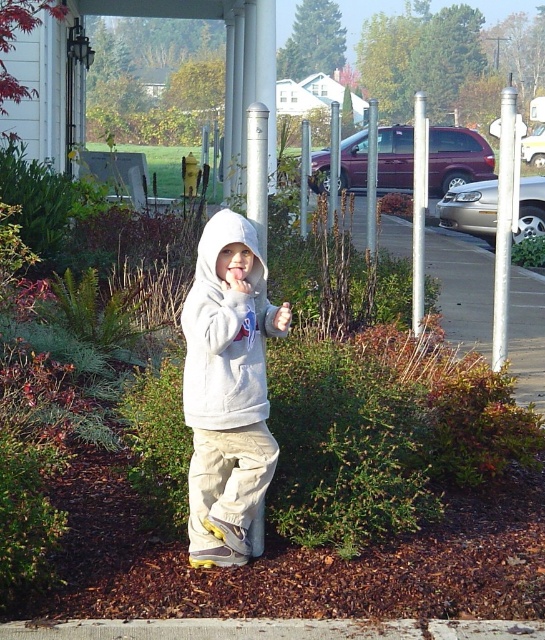
Is light gray hoodie at center smaller than silver metallic pole at center?

Yes, light gray hoodie at center is smaller than silver metallic pole at center.

Is light gray hoodie at center shorter than silver metallic pole at center?

Yes, light gray hoodie at center is shorter than silver metallic pole at center.

At what (x,y) coordinates should I click in order to perform the action: click on light gray hoodie at center. Please return your answer as a coordinate pair (x, y). Looking at the image, I should click on (227, 388).

Does point (196, 316) come in front of point (505, 220)?

Yes, it is.

The image size is (545, 640). Find the location of `light gray hoodie at center`. light gray hoodie at center is located at coordinates click(227, 388).

Between white plastic pole at center and silver metallic pole at center, which one appears on the right side from the viewer's perspective?

From the viewer's perspective, white plastic pole at center appears more on the right side.

At what (x,y) coordinates should I click in order to perform the action: click on white plastic pole at center. Please return your answer as a coordinate pair (x, y). Looking at the image, I should click on (504, 227).

Locate an element on the screen. white plastic pole at center is located at coordinates (504, 227).

This screenshot has height=640, width=545. Find the location of `white plastic pole at center`. white plastic pole at center is located at coordinates (504, 227).